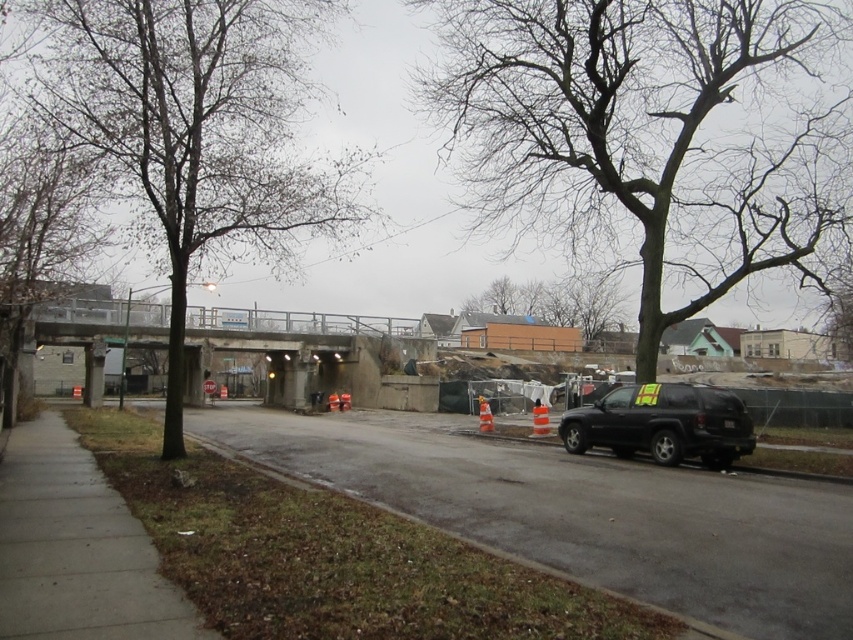
You are a city planner analyzing the urban layout. Given the scene, which object occupies more horizontal space in the image between the bare wood tree at left and the black matte suv at right?

The bare wood tree at left is wider than the black matte suv at right, so it occupies more horizontal space in the image.

You are standing at the point marked by the coordinate point at point (196, 131). You need to walk to the black SUV parked on the right side of the road. Which direction should you head towards?

You should head towards the right side of the road from the point at point (196, 131) since the black SUV is parked there.